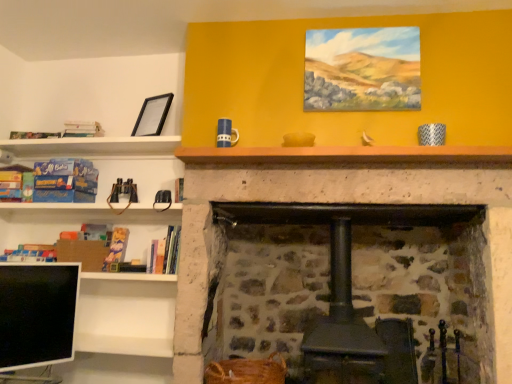
The image size is (512, 384). I want to click on hardcover book at left, the 5th book positioned from the left, so click(x=116, y=247).

Identify the location of white matte bookshelf at upper left, which appears as the fourth book when viewed from the right. (82, 129).

What is the approximate width of white matte bookshelf at upper left, positioned as the fourth book in left-to-right order?

6.37 inches.

How much space does hardcover book at left, which appears as the 6th book when viewed from the right, occupy vertically?

hardcover book at left, which appears as the 6th book when viewed from the right, is 4.03 inches in height.

What do you see at coordinates (30, 253) in the screenshot?
I see `hardcover book at left, which appears as the 6th book when viewed from the right` at bounding box center [30, 253].

What do you see at coordinates (37, 314) in the screenshot? I see `black glossy computer monitor at lower left` at bounding box center [37, 314].

What do you see at coordinates (65, 180) in the screenshot? The image size is (512, 384). I see `blue cardboard box at left, the 5th book viewed from the right` at bounding box center [65, 180].

Measure the distance between point (35,188) and camera.

Point (35,188) and camera are 8.57 feet apart from each other.

Describe the element at coordinates (12, 182) in the screenshot. I see `matte blue book at left, which appears as the seventh book when viewed from the right` at that location.

This screenshot has height=384, width=512. I want to click on hardcover book at left, the 3th book positioned from the right, so click(116, 247).

How many degrees apart are the facing directions of hardcover book at left, the 5th book positioned from the left, and black glossy computer monitor at lower left?

The angular difference between hardcover book at left, the 5th book positioned from the left, and black glossy computer monitor at lower left is 50.5 degrees.

Is hardcover book at left, the 3th book positioned from the right, located outside black glossy computer monitor at lower left?

Yes.

Can you confirm if hardcover book at left, the 5th book positioned from the left, is bigger than black glossy computer monitor at lower left?

Actually, hardcover book at left, the 5th book positioned from the left, might be smaller than black glossy computer monitor at lower left.

From a real-world perspective, is hardcover book at left, the 3th book positioned from the right, located higher than black glossy computer monitor at lower left?

Yes.

How much distance is there between matte blue book at left, which appears as the seventh book when viewed from the right, and blue cardboard box at left, which is counted as the 3th book, starting from the left?

matte blue book at left, which appears as the seventh book when viewed from the right, and blue cardboard box at left, which is counted as the 3th book, starting from the left, are 10.10 inches apart.

This screenshot has width=512, height=384. There is a matte blue book at left, which is the 1th book from left to right. In order to click on the 1st book above it (from a real-world perspective) in this screenshot , I will do `click(65, 180)`.

Can you confirm if matte blue book at left, which is the 1th book from left to right, is positioned to the right of blue cardboard box at left, the 5th book viewed from the right?

Incorrect, matte blue book at left, which is the 1th book from left to right, is not on the right side of blue cardboard box at left, the 5th book viewed from the right.

Could you tell me if matte blue book at left, which appears as the seventh book when viewed from the right, is turned towards blue cardboard box at left, which is counted as the 3th book, starting from the left?

No, matte blue book at left, which appears as the seventh book when viewed from the right, is not aimed at blue cardboard box at left, which is counted as the 3th book, starting from the left.

From a real-world perspective, which is physically below, black glossy computer monitor at lower left or hardcover book at left, which appears as the 6th book when viewed from the right?

In real-world perspective, black glossy computer monitor at lower left is lower.

You are a GUI agent. You are given a task and a screenshot of the screen. Output one action in this format:
    pyautogui.click(x=<x>, y=<y>)
    Task: Click on the 1st book above the black glossy computer monitor at lower left (from the image's perspective)
    The width and height of the screenshot is (512, 384).
    Given the screenshot: What is the action you would take?
    pyautogui.click(x=30, y=253)

Considering the positions of objects black glossy computer monitor at lower left and hardcover book at left, which ranks as the 2th book in left-to-right order, in the image provided, who is behind, black glossy computer monitor at lower left or hardcover book at left, which ranks as the 2th book in left-to-right order,?

hardcover book at left, which ranks as the 2th book in left-to-right order, is behind.

The width and height of the screenshot is (512, 384). I want to click on the 7th book behind the wooden shelf at upper center, so click(82, 129).

Could you tell me if white matte bookshelf at upper left, positioned as the fourth book in left-to-right order, is turned towards wooden shelf at upper center?

No.

From the picture: Considering their positions, is white matte bookshelf at upper left, which appears as the fourth book when viewed from the right, located in front of or behind wooden shelf at upper center?

Visually, white matte bookshelf at upper left, which appears as the fourth book when viewed from the right, is located behind wooden shelf at upper center.

Could wooden shelf at upper center be considered to be inside white matte bookshelf at upper left, positioned as the fourth book in left-to-right order?

No, wooden shelf at upper center is not inside white matte bookshelf at upper left, positioned as the fourth book in left-to-right order.

Is point (3, 259) in front of point (75, 123)?

Yes.

Between hardcover book at left, which appears as the 6th book when viewed from the right, and white matte bookshelf at upper left, which appears as the fourth book when viewed from the right, which one appears on the left side from the viewer's perspective?

hardcover book at left, which appears as the 6th book when viewed from the right, is more to the left.

From a real-world perspective, does blue cardboard box at left, the 5th book viewed from the right, sit lower than hardcover book at left, which appears as the 6th book when viewed from the right?

No.

Is blue cardboard box at left, the 5th book viewed from the right, next to hardcover book at left, which ranks as the 2th book in left-to-right order, and touching it?

No, blue cardboard box at left, the 5th book viewed from the right, is not next to hardcover book at left, which ranks as the 2th book in left-to-right order.

From their relative heights in the image, would you say blue cardboard box at left, which is counted as the 3th book, starting from the left, is taller or shorter than hardcover book at left, which appears as the 6th book when viewed from the right?

Clearly, blue cardboard box at left, which is counted as the 3th book, starting from the left, is taller compared to hardcover book at left, which appears as the 6th book when viewed from the right.

From the image's perspective, which is below, blue cardboard box at left, which is counted as the 3th book, starting from the left, or hardcover book at left, which ranks as the 2th book in left-to-right order?

hardcover book at left, which ranks as the 2th book in left-to-right order, is shown below in the image.

Would you say black glossy computer monitor at lower left contains blue cardboard box at left, which is counted as the 3th book, starting from the left?

No, blue cardboard box at left, which is counted as the 3th book, starting from the left, is not a part of black glossy computer monitor at lower left.

Which of these two, black glossy computer monitor at lower left or blue cardboard box at left, the 5th book viewed from the right, is thinner?

black glossy computer monitor at lower left is thinner.

Is black glossy computer monitor at lower left at the right side of blue cardboard box at left, the 5th book viewed from the right?

Indeed, black glossy computer monitor at lower left is positioned on the right side of blue cardboard box at left, the 5th book viewed from the right.

This screenshot has height=384, width=512. What are the coordinates of `the 3rd book above the black glossy computer monitor at lower left (from the image's perspective)` in the screenshot? It's located at (116, 247).

In order to click on the 3rd book behind when counting from the blue cardboard box at left, which is counted as the 3th book, starting from the left in this screenshot , I will do `click(12, 182)`.

When comparing their distances from hardcover book at left, which is the seventh book from left to right, does white matte bookshelf at upper left, which appears as the fourth book when viewed from the right, or wooden shelf at upper center seem closer?

The object closer to hardcover book at left, which is the seventh book from left to right, is wooden shelf at upper center.

From the image, which object appears to be nearer to blue cardboard box at left, the 5th book viewed from the right, white matte bookshelf at upper left, which appears as the fourth book when viewed from the right, or black matte picture frame at upper left?

white matte bookshelf at upper left, which appears as the fourth book when viewed from the right.

Looking at the image, which one is located further to black glossy computer monitor at lower left, hardcover book at left, the 3th book positioned from the right, or matte blue book at left, which is the 1th book from left to right?

Based on the image, matte blue book at left, which is the 1th book from left to right, appears to be further to black glossy computer monitor at lower left.

Looking at the image, which one is located further to hardcover book at left, the 3th book positioned from the right, blue cardboard box at left, the 5th book viewed from the right, or wooden shelf at upper center?

The object further to hardcover book at left, the 3th book positioned from the right, is wooden shelf at upper center.

Which object lies further to the anchor point hardcover book at left, the 5th book positioned from the left, white matte bookshelf at upper left, which appears as the fourth book when viewed from the right, or hardcover book at left, which is the seventh book from left to right?

white matte bookshelf at upper left, which appears as the fourth book when viewed from the right, is positioned further to the anchor hardcover book at left, the 5th book positioned from the left.

From the image, which object appears to be farther from black matte picture frame at upper left, brown woven basket at lower center or hardcover book at center, the 6th book from the left?

Based on the image, brown woven basket at lower center appears to be further to black matte picture frame at upper left.

Estimate the real-world distances between objects in this image. Which object is closer to hardcover book at left, which ranks as the 2th book in left-to-right order, blue cardboard box at left, which is counted as the 3th book, starting from the left, or black matte picture frame at upper left?

blue cardboard box at left, which is counted as the 3th book, starting from the left.

Estimate the real-world distances between objects in this image. Which object is closer to blue cardboard box at left, the 5th book viewed from the right, matte blue book at left, which is the 1th book from left to right, or white matte bookshelf at upper left, positioned as the fourth book in left-to-right order?

matte blue book at left, which is the 1th book from left to right.

Locate an element on the screen. computer monitor situated between hardcover book at left, which ranks as the 2th book in left-to-right order, and brown woven basket at lower center from left to right is located at coordinates (37, 314).

This screenshot has width=512, height=384. I want to click on picture frame between matte blue book at left, which is the 1th book from left to right, and brown woven basket at lower center, in the horizontal direction, so click(153, 115).

You are a GUI agent. You are given a task and a screenshot of the screen. Output one action in this format:
    pyautogui.click(x=<x>, y=<y>)
    Task: Click on the picture frame located between black glossy computer monitor at lower left and wooden shelf at upper center in the left-right direction
    Image resolution: width=512 pixels, height=384 pixels.
    Given the screenshot: What is the action you would take?
    [x=153, y=115]

The height and width of the screenshot is (384, 512). In order to click on picture frame between matte blue book at left, which is the 1th book from left to right, and wooden shelf at upper center from left to right in this screenshot , I will do `click(153, 115)`.